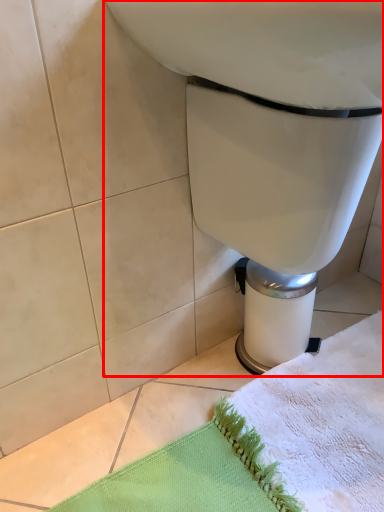
Question: From the image's perspective, where is toilet (annotated by the red box) located relative to bath towel?

Choices:
 (A) below
 (B) above

Answer: (B)